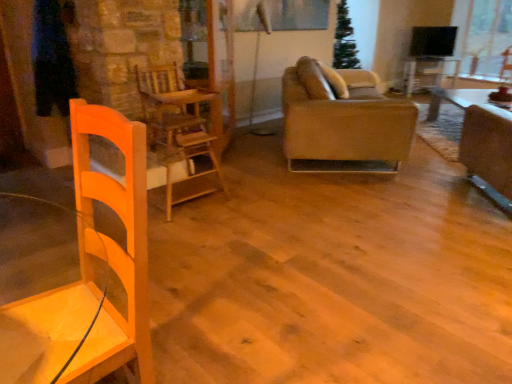
Find the location of a particular element. The height and width of the screenshot is (384, 512). empty space that is to the right of wooden chair at center is located at coordinates (250, 197).